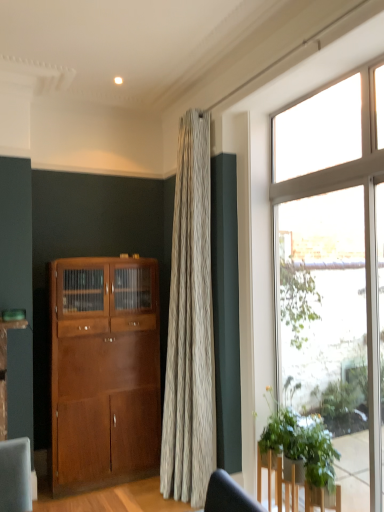
Question: From a real-world perspective, is shiny brown cabinet at left located beneath green leafy plant at lower right?

Choices:
 (A) no
 (B) yes

Answer: (A)

Question: Is shiny brown cabinet at left touching green leafy plant at lower right?

Choices:
 (A) yes
 (B) no

Answer: (B)

Question: Is shiny brown cabinet at left positioned in front of green leafy plant at lower right?

Choices:
 (A) no
 (B) yes

Answer: (A)

Question: Is shiny brown cabinet at left far away from green leafy plant at lower right?

Choices:
 (A) yes
 (B) no

Answer: (A)

Question: Is shiny brown cabinet at left shorter than green leafy plant at lower right?

Choices:
 (A) yes
 (B) no

Answer: (B)

Question: Considering the relative sizes of shiny brown cabinet at left and green leafy plant at lower right in the image provided, is shiny brown cabinet at left thinner than green leafy plant at lower right?

Choices:
 (A) yes
 (B) no

Answer: (B)

Question: Does green leafy plant at lower right have a smaller size compared to shiny brown cabinet at left?

Choices:
 (A) yes
 (B) no

Answer: (A)

Question: From a real-world perspective, is green leafy plant at lower right below shiny brown cabinet at left?

Choices:
 (A) yes
 (B) no

Answer: (A)

Question: From a real-world perspective, is green leafy plant at lower right physically above shiny brown cabinet at left?

Choices:
 (A) yes
 (B) no

Answer: (B)

Question: Can you confirm if green leafy plant at lower right is taller than shiny brown cabinet at left?

Choices:
 (A) no
 (B) yes

Answer: (A)

Question: From the image's perspective, is green leafy plant at lower right below shiny brown cabinet at left?

Choices:
 (A) no
 (B) yes

Answer: (B)

Question: Is green leafy plant at lower right to the left of shiny brown cabinet at left from the viewer's perspective?

Choices:
 (A) no
 (B) yes

Answer: (A)

Question: From the image's perspective, is clear glass window at right beneath shiny brown cabinet at left?

Choices:
 (A) yes
 (B) no

Answer: (B)